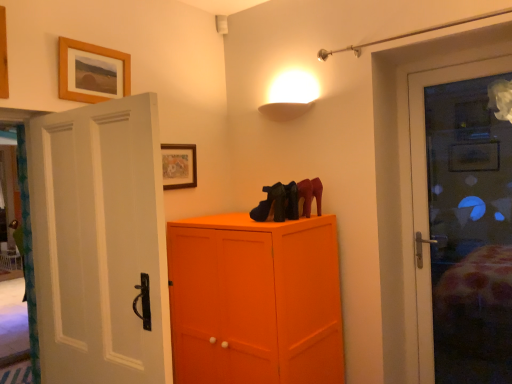
Question: Considering their positions, is wooden picture frame at upper center, the 2th picture frame from the right, located in front of or behind matte black shoes at center?

Choices:
 (A) behind
 (B) front

Answer: (B)

Question: From a real-world perspective, is wooden picture frame at upper center, placed as the second picture frame when sorted from bottom to top, above or below matte black shoes at center?

Choices:
 (A) below
 (B) above

Answer: (B)

Question: Which object is positioned farthest from the wooden picture frame at upper center, placed as the 2th picture frame when sorted from back to front?

Choices:
 (A) matte black shoes at center
 (B) matte wooden picture frame at upper center, placed as the 2th picture frame when sorted from front to back

Answer: (A)

Question: Which is nearer to the wooden picture frame at upper center, the 2th picture frame from the right?

Choices:
 (A) matte black shoes at center
 (B) matte wooden picture frame at upper center, acting as the 2th picture frame starting from the left

Answer: (B)